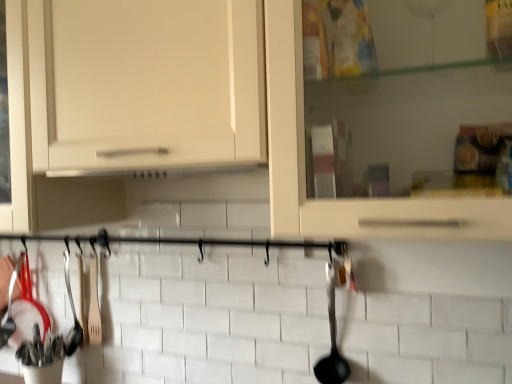
Question: Is black plastic ladle at right, which is the second silverware from back to front, not near white matte cabinet at center?

Choices:
 (A) no
 (B) yes

Answer: (A)

Question: Is black plastic ladle at right, acting as the 2th silverware starting from the left, thinner than white matte cabinet at center?

Choices:
 (A) yes
 (B) no

Answer: (A)

Question: From a real-world perspective, is black plastic ladle at right, acting as the 2th silverware starting from the left, beneath white matte cabinet at center?

Choices:
 (A) no
 (B) yes

Answer: (B)

Question: Considering the relative sizes of black plastic ladle at right, the 1th silverware when ordered from right to left, and white matte cabinet at center in the image provided, is black plastic ladle at right, the 1th silverware when ordered from right to left, wider than white matte cabinet at center?

Choices:
 (A) no
 (B) yes

Answer: (A)

Question: Does black plastic ladle at right, placed as the first silverware when sorted from front to back, have a larger size compared to white matte cabinet at center?

Choices:
 (A) yes
 (B) no

Answer: (B)

Question: In the image, is black plastic ladle at right, acting as the 2th silverware starting from the left, positioned in front of or behind wooden spatula at left, the 1th silverware viewed from the back?

Choices:
 (A) behind
 (B) front

Answer: (B)

Question: Which is correct: black plastic ladle at right, which is the second silverware from back to front, is inside wooden spatula at left, the 1th silverware viewed from the back, or outside of it?

Choices:
 (A) outside
 (B) inside

Answer: (A)

Question: Based on their sizes in the image, would you say black plastic ladle at right, which is the second silverware from back to front, is bigger or smaller than wooden spatula at left, acting as the second silverware starting from the right?

Choices:
 (A) small
 (B) big

Answer: (B)

Question: Considering the positions of black plastic ladle at right, placed as the first silverware when sorted from front to back, and wooden spatula at left, the 1th silverware viewed from the back, in the image, is black plastic ladle at right, placed as the first silverware when sorted from front to back, taller or shorter than wooden spatula at left, the 1th silverware viewed from the back,?

Choices:
 (A) tall
 (B) short

Answer: (A)

Question: Considering their positions, is wooden spatula at left, the 1th silverware viewed from the back, located in front of or behind black plastic ladle at right, placed as the first silverware when sorted from front to back?

Choices:
 (A) front
 (B) behind

Answer: (B)

Question: Based on their positions, is wooden spatula at left, the 1th silverware viewed from the back, located to the left or right of black plastic ladle at right, the 1th silverware when ordered from right to left?

Choices:
 (A) left
 (B) right

Answer: (A)

Question: From a real-world perspective, is wooden spatula at left, acting as the second silverware starting from the right, above or below black plastic ladle at right, acting as the 2th silverware starting from the left?

Choices:
 (A) below
 (B) above

Answer: (B)

Question: In terms of height, does wooden spatula at left, the 1th silverware viewed from the back, look taller or shorter compared to black plastic ladle at right, the 1th silverware when ordered from right to left?

Choices:
 (A) tall
 (B) short

Answer: (B)

Question: From a real-world perspective, is white matte cabinet at center physically located above or below black plastic ladle at right, which is the second silverware from back to front?

Choices:
 (A) above
 (B) below

Answer: (A)

Question: Choose the correct answer: Is white matte cabinet at center inside black plastic ladle at right, acting as the 2th silverware starting from the left, or outside it?

Choices:
 (A) inside
 (B) outside

Answer: (B)